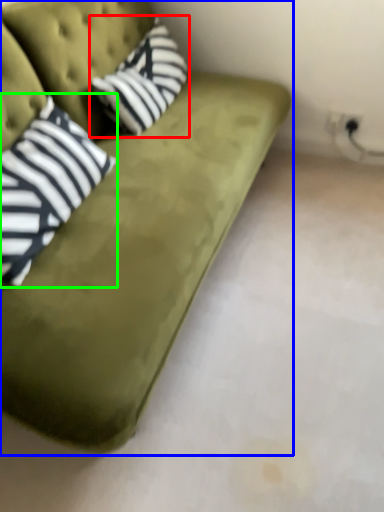
Question: Considering the real-world distances, which object is farthest from throw pillow (highlighted by a red box)? studio couch (highlighted by a blue box) or pillow (highlighted by a green box)?

Choices:
 (A) studio couch
 (B) pillow

Answer: (B)